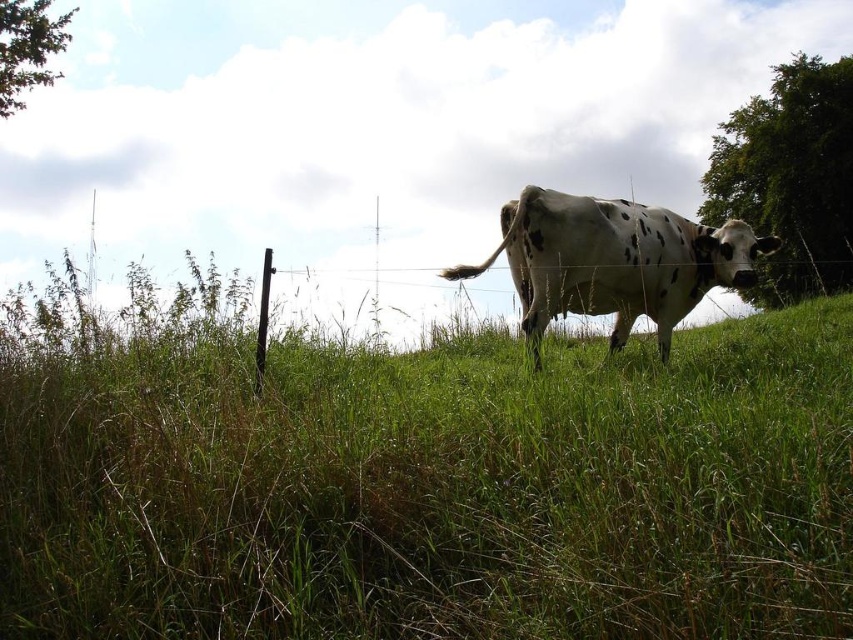
You are a drone operator trying to land a drone on the green grassy area at center. The drone has a landing pad that must align with a specific coordinate point. Is the point at coordinate point (432, 490) on the green grassy area at center?

The point at coordinate point (432, 490) is on the green grassy area at center, so yes, the drone can land there.

From the picture: You are standing at the origin point of the image coordinate system. The cow is at point [614,260]. If you want to walk directly towards the cow, which direction should you head?

You should head towards the point [614,260] where the white spotted cow at center is located.